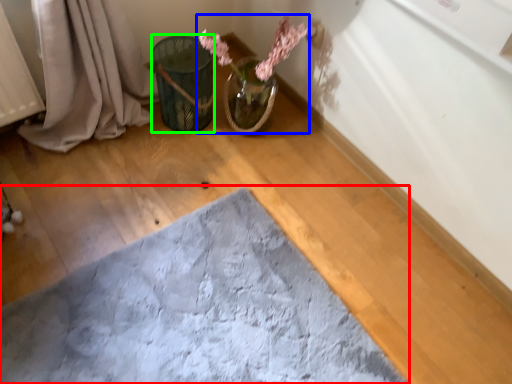
Question: Estimate the real-world distances between objects in this image. Which object is farther from bath mat (highlighted by a red box), floral arrangement (highlighted by a blue box) or flower basket (highlighted by a green box)?

Choices:
 (A) floral arrangement
 (B) flower basket

Answer: (A)